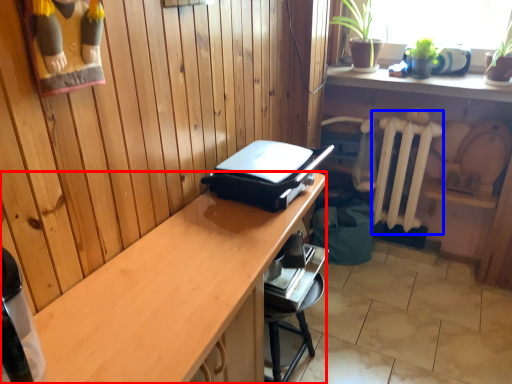
Question: Which object is closer to the camera taking this photo, desk (highlighted by a red box) or radiator (highlighted by a blue box)?

Choices:
 (A) desk
 (B) radiator

Answer: (A)